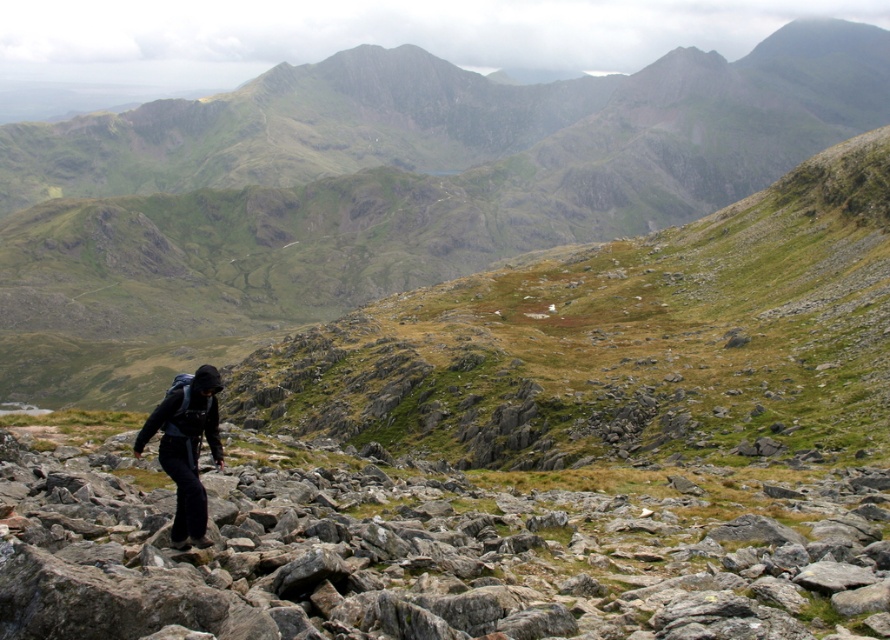
Does gray rough rock at center have a lesser width compared to dark gray backpack at center?

No, gray rough rock at center is not thinner than dark gray backpack at center.

What are the coordinates of `gray rough rock at center` in the screenshot? It's located at (417, 557).

Does point (93, 548) come closer to viewer compared to point (152, 416)?

Yes, it is in front of point (152, 416).

Image resolution: width=890 pixels, height=640 pixels. I want to click on gray rough rock at center, so click(x=417, y=557).

Between green grassy hillside at center and dark gray backpack at center, which one has less height?

With less height is dark gray backpack at center.

Between green grassy hillside at center and dark gray backpack at center, which one is positioned lower?

dark gray backpack at center

Where is `green grassy hillside at center`? The width and height of the screenshot is (890, 640). green grassy hillside at center is located at coordinates (418, 209).

The height and width of the screenshot is (640, 890). In order to click on green grassy hillside at center in this screenshot , I will do `click(418, 209)`.

The image size is (890, 640). In order to click on green grassy hillside at center in this screenshot , I will do `click(418, 209)`.